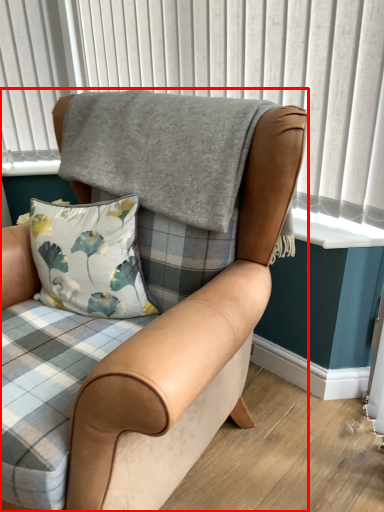
Question: From the image's perspective, where is chair (annotated by the red box) located relative to window frame?

Choices:
 (A) below
 (B) above

Answer: (A)